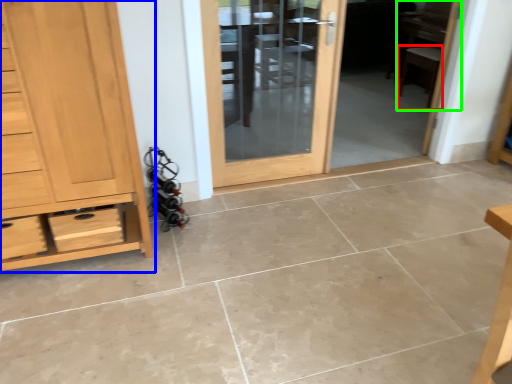
Question: Estimate the real-world distances between objects in this image. Which object is farther from chair (highlighted by a red box), chest of drawers (highlighted by a blue box) or chair (highlighted by a green box)?

Choices:
 (A) chest of drawers
 (B) chair

Answer: (A)